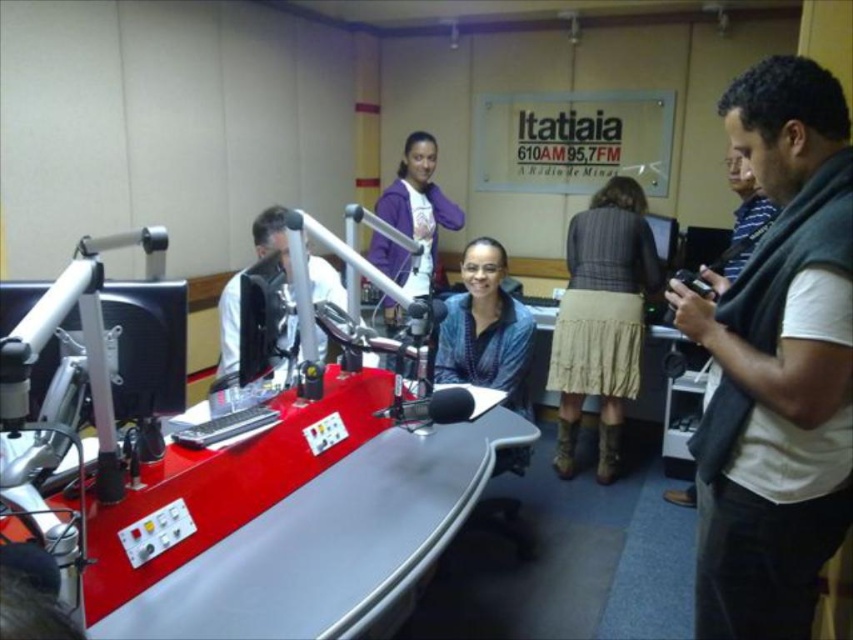
Is striped fabric skirt at center to the right of white shirt at left from the viewer's perspective?

Yes, striped fabric skirt at center is to the right of white shirt at left.

Does point (601, 401) lie behind point (285, 253)?

That is True.

At what (x,y) coordinates should I click in order to perform the action: click on striped fabric skirt at center. Please return your answer as a coordinate pair (x, y). Looking at the image, I should click on (601, 317).

Is gray sweater at right above purple fleece jacket at upper center?

Actually, gray sweater at right is below purple fleece jacket at upper center.

Between gray sweater at right and purple fleece jacket at upper center, which one appears on the right side from the viewer's perspective?

gray sweater at right is more to the right.

Is point (805, 88) more distant than point (456, 212)?

No, it is not.

Find the location of `gray sweater at right`. gray sweater at right is located at coordinates click(x=776, y=364).

Is point (459, 348) positioned after point (666, 497)?

No, it is in front of (666, 497).

Is blue textured sweater at center further to the viewer compared to gray striped sweater at right?

Yes, blue textured sweater at center is behind gray striped sweater at right.

Between point (461, 340) and point (734, 236), which one is positioned behind?

The point (734, 236) is more distant.

Find the location of a particular element. Image resolution: width=853 pixels, height=640 pixels. blue textured sweater at center is located at coordinates (485, 328).